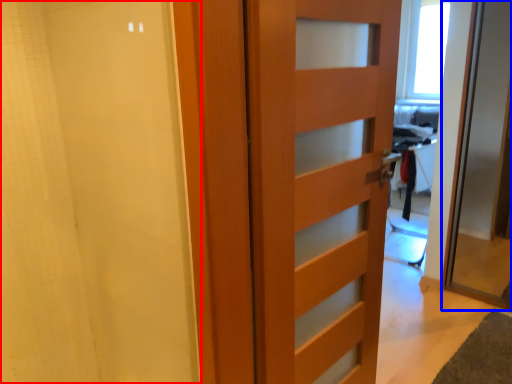
Question: Which object is closer to the camera taking this photo, shower curtain (highlighted by a red box) or door (highlighted by a blue box)?

Choices:
 (A) shower curtain
 (B) door

Answer: (A)